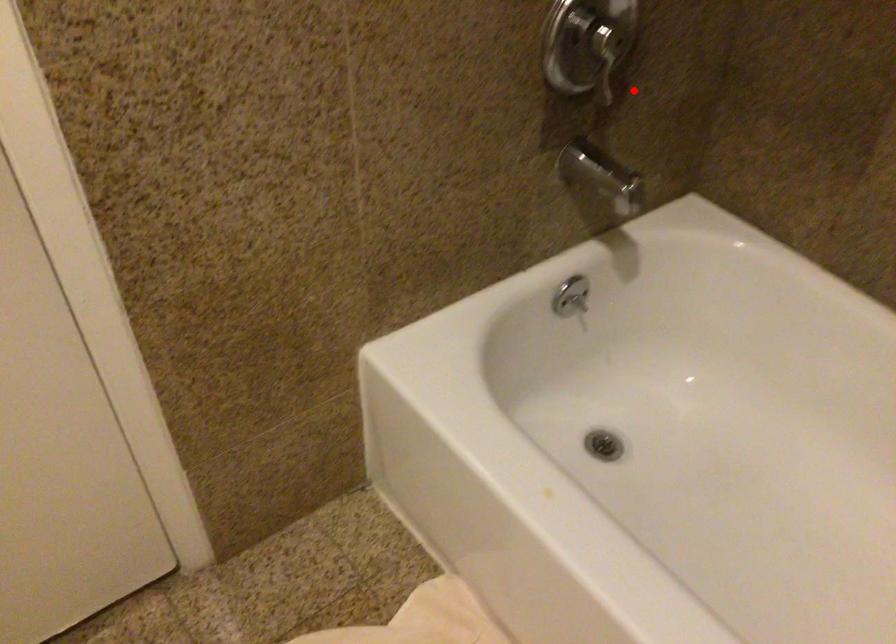
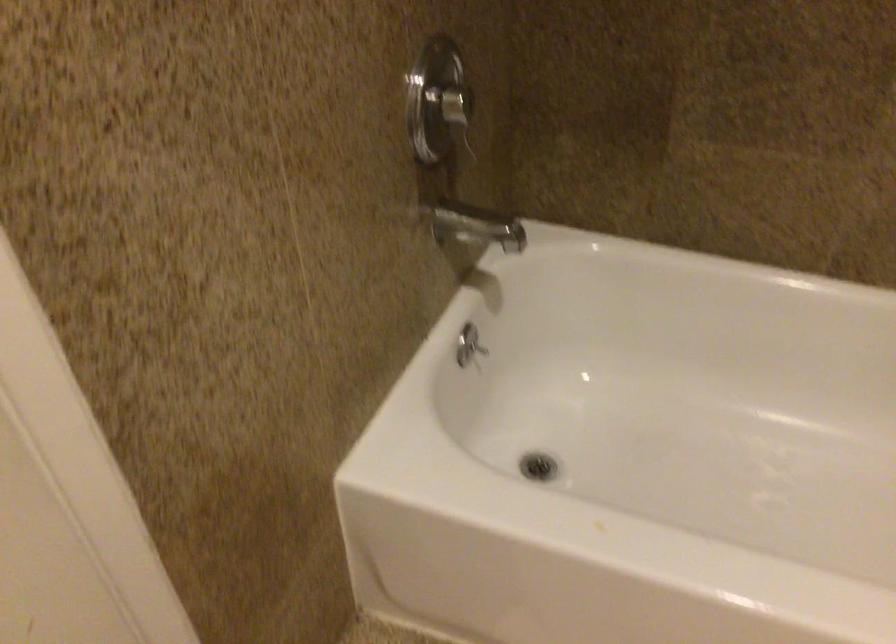
Where in the second image is the point corresponding to the highlighted location from the first image?

(467, 140)